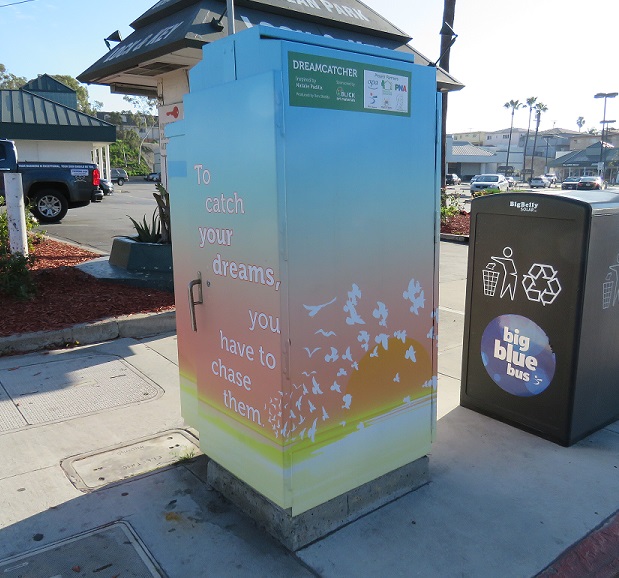
The width and height of the screenshot is (619, 578). Identify the location of trashcan. (534, 233), (550, 263), (487, 313), (574, 377), (572, 426), (595, 335), (585, 266).